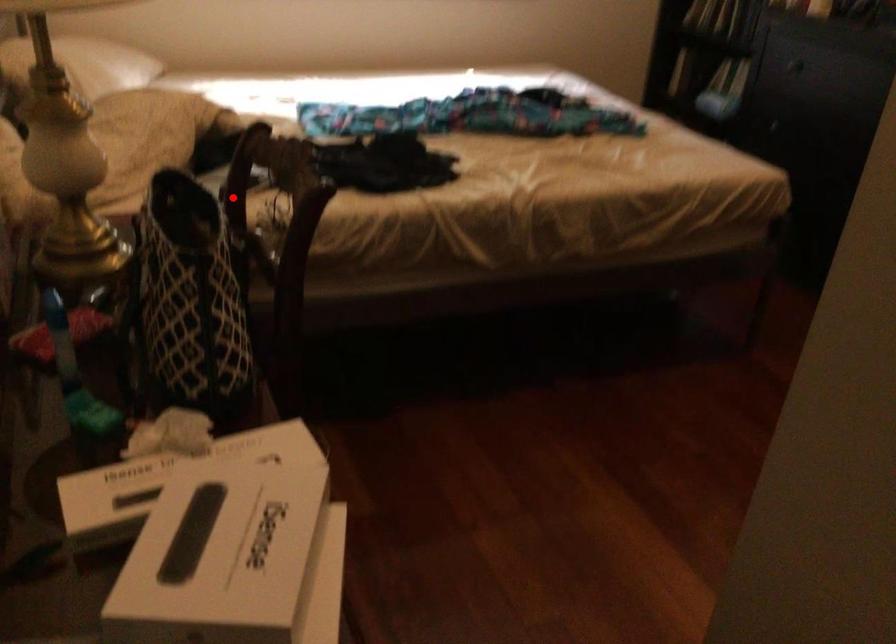
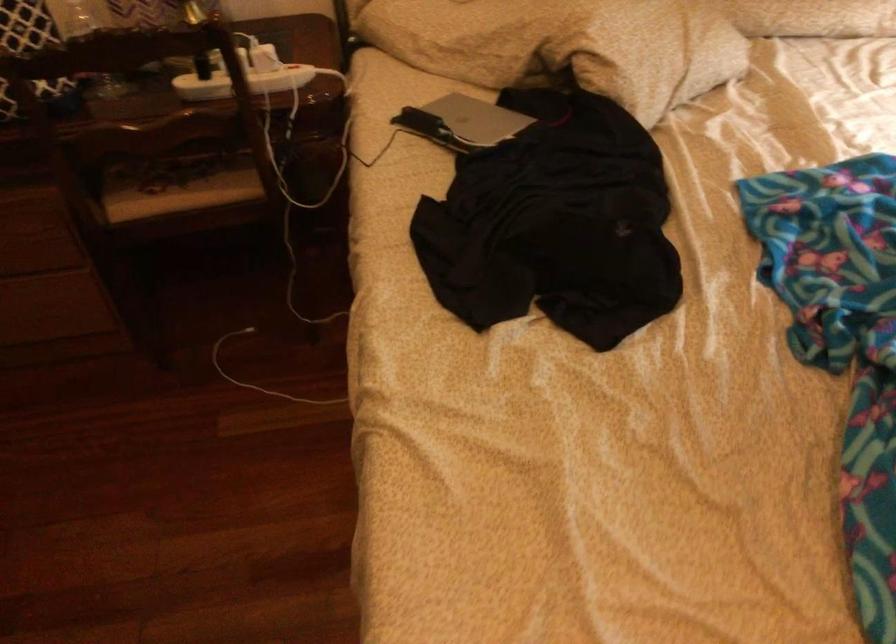
The point at the highlighted location is marked in the first image. Where is the corresponding point in the second image?

(243, 82)